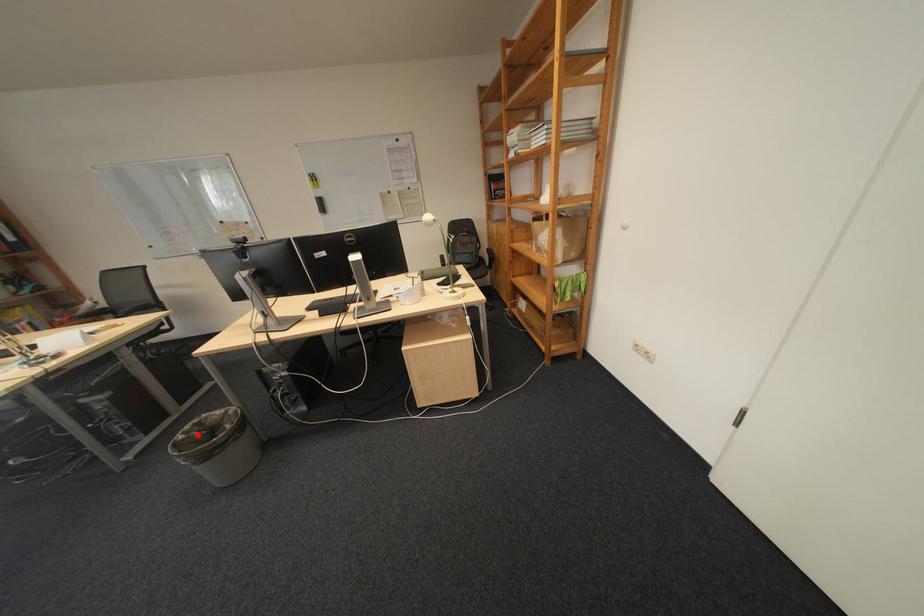
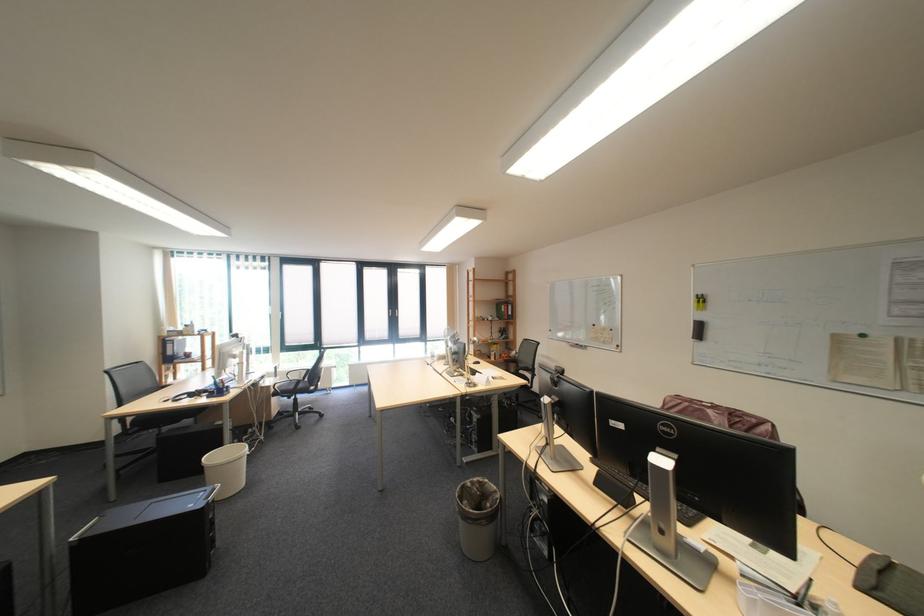
Question: I am providing you with two images of the same scene from different viewpoints. Given a red point in image1, look at the same physical point in image2. Is it:

Choices:
 (A) Closer to the viewpoint
 (B) Farther from the viewpoint

Answer: (A)